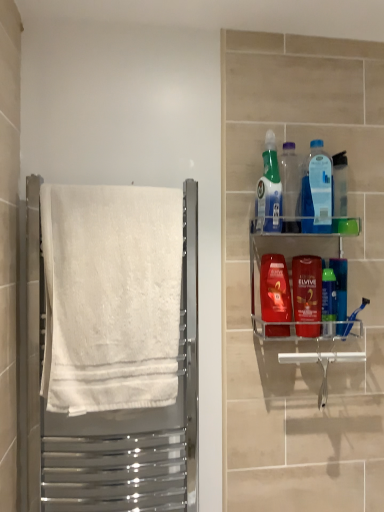
Question: Are translucent plastic mouthwash at center right, which is the third mouthwash from right to left, and translucent blue mouthwash at center right, which is the 1th mouthwash from left to right, located far from each other?

Choices:
 (A) yes
 (B) no

Answer: (B)

Question: Is translucent blue mouthwash at center right, which is the 1th mouthwash from left to right, at the back of translucent plastic mouthwash at center right, placed as the 2th mouthwash when sorted from left to right?

Choices:
 (A) no
 (B) yes

Answer: (A)

Question: Considering the relative sizes of translucent plastic mouthwash at center right, placed as the 2th mouthwash when sorted from left to right, and translucent blue mouthwash at center right, marked as the fourth mouthwash in a right-to-left arrangement, in the image provided, is translucent plastic mouthwash at center right, placed as the 2th mouthwash when sorted from left to right, bigger than translucent blue mouthwash at center right, marked as the fourth mouthwash in a right-to-left arrangement,?

Choices:
 (A) yes
 (B) no

Answer: (B)

Question: Is translucent plastic mouthwash at center right, placed as the 2th mouthwash when sorted from left to right, facing towards translucent blue mouthwash at center right, which is the 1th mouthwash from left to right?

Choices:
 (A) yes
 (B) no

Answer: (B)

Question: Can you confirm if translucent plastic mouthwash at center right, which is the third mouthwash from right to left, is positioned to the right of translucent blue mouthwash at center right, which is the 1th mouthwash from left to right?

Choices:
 (A) yes
 (B) no

Answer: (A)

Question: In the image, is translucent plastic spray bottle at upper right, which appears as the 1th cleaning product when viewed from the left, positioned in front of or behind clear acrylic shelf at upper right?

Choices:
 (A) front
 (B) behind

Answer: (B)

Question: Considering the positions of point (269, 181) and point (337, 236), is point (269, 181) closer or farther from the camera than point (337, 236)?

Choices:
 (A) closer
 (B) farther

Answer: (A)

Question: Choose the correct answer: Is translucent plastic spray bottle at upper right, which is counted as the 2th cleaning product, starting from the right, inside clear acrylic shelf at upper right or outside it?

Choices:
 (A) outside
 (B) inside

Answer: (A)

Question: Considering the positions of translucent plastic spray bottle at upper right, which is counted as the 2th cleaning product, starting from the right, and clear acrylic shelf at upper right in the image, is translucent plastic spray bottle at upper right, which is counted as the 2th cleaning product, starting from the right, wider or thinner than clear acrylic shelf at upper right?

Choices:
 (A) wide
 (B) thin

Answer: (B)

Question: Choose the correct answer: Is translucent plastic spray bottle at upper right, which is counted as the 2th cleaning product, starting from the right, inside transparent plastic bottle at upper center, the 1th bottle in the left-to-right sequence, or outside it?

Choices:
 (A) inside
 (B) outside

Answer: (B)

Question: Visually, is translucent plastic spray bottle at upper right, which is counted as the 2th cleaning product, starting from the right, positioned to the left or to the right of transparent plastic bottle at upper center, the 1th bottle in the left-to-right sequence?

Choices:
 (A) right
 (B) left

Answer: (B)

Question: From a real-world perspective, is translucent plastic spray bottle at upper right, which appears as the 1th cleaning product when viewed from the left, positioned above or below transparent plastic bottle at upper center, the 1th bottle in the left-to-right sequence?

Choices:
 (A) above
 (B) below

Answer: (A)

Question: From the image's perspective, is translucent plastic spray bottle at upper right, which is counted as the 2th cleaning product, starting from the right, above or below transparent plastic bottle at upper center, the 2th bottle from the right?

Choices:
 (A) above
 (B) below

Answer: (A)

Question: From a real-world perspective, relative to translucent plastic spray bottle at upper right, which appears as the 1th cleaning product when viewed from the left, is green plastic mouthwash at right, the third mouthwash positioned from the left, vertically above or below?

Choices:
 (A) below
 (B) above

Answer: (A)

Question: Is green plastic mouthwash at right, which is the 2th mouthwash in right-to-left order, wider or thinner than translucent plastic spray bottle at upper right, which is counted as the 2th cleaning product, starting from the right?

Choices:
 (A) thin
 (B) wide

Answer: (A)